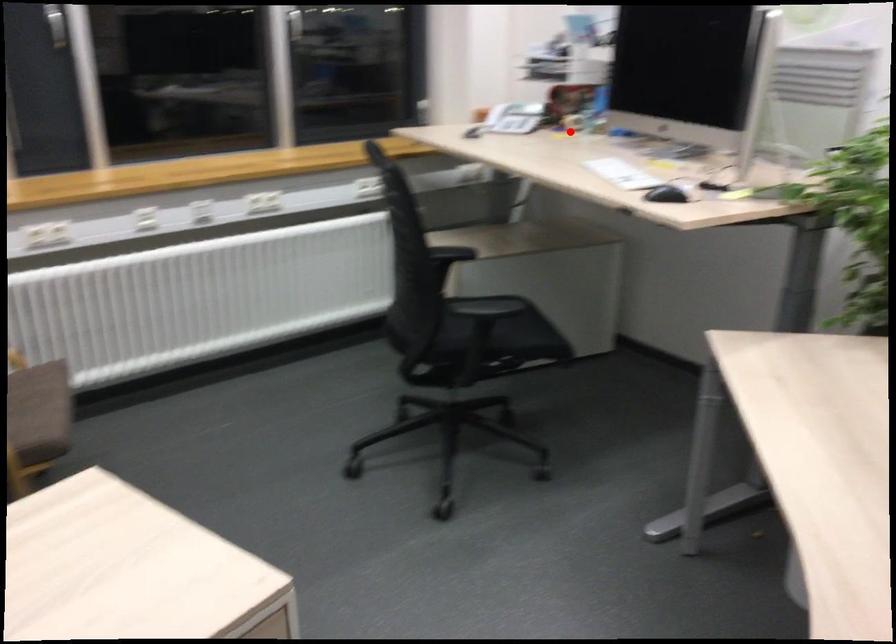
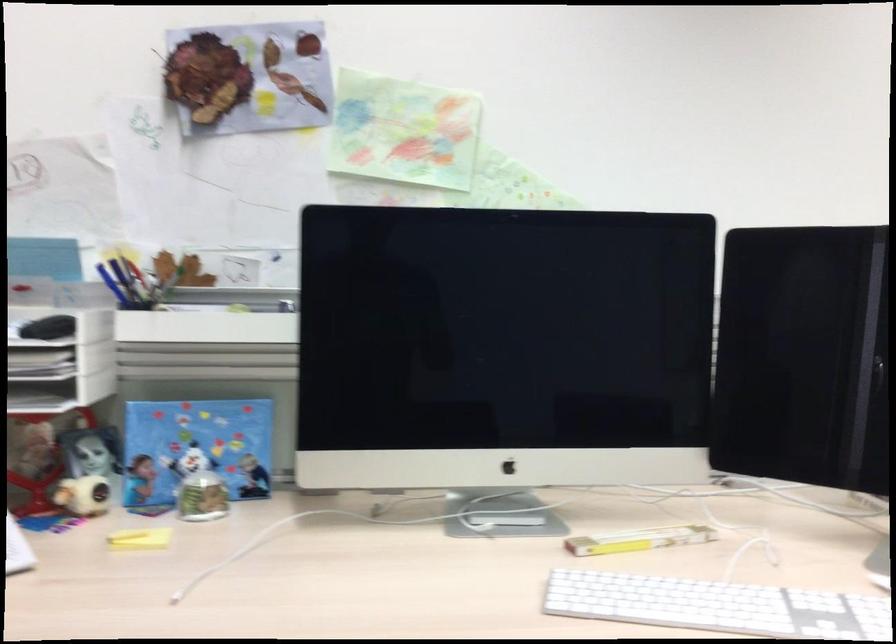
Question: I am providing you with two images of the same scene from different viewpoints. Given a red point in image1, look at the same physical point in image2. Is it:

Choices:
 (A) Closer to the viewpoint
 (B) Farther from the viewpoint

Answer: (A)